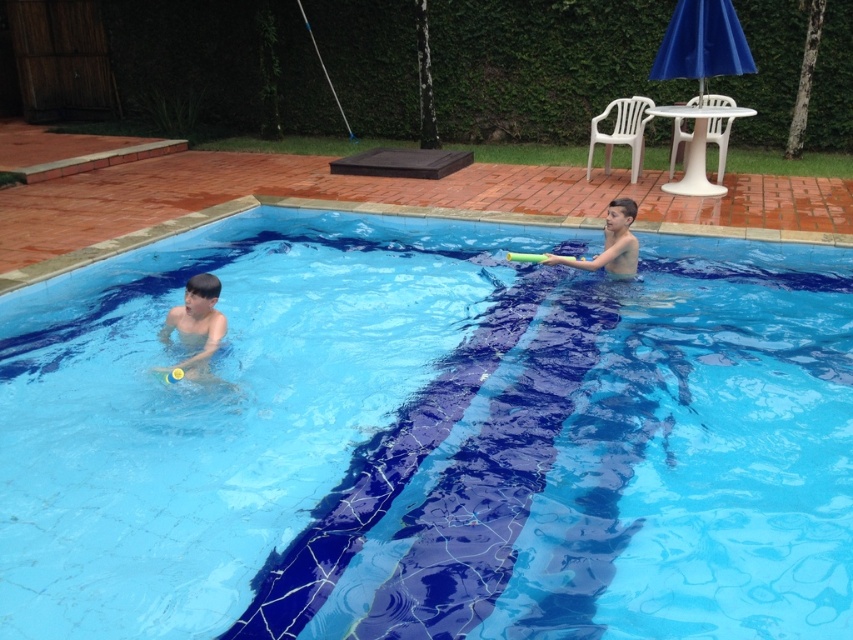
Is point (686, 468) farther from viewer compared to point (212, 310)?

No, (686, 468) is in front of (212, 310).

Who is lower down, transparent blue water at center or matte black boy at left?

transparent blue water at center

Identify the location of transparent blue water at center. This screenshot has width=853, height=640. (430, 440).

The height and width of the screenshot is (640, 853). Identify the location of transparent blue water at center. (430, 440).

Can you confirm if transparent blue water at center is thinner than smooth yellow toy at upper right?

Incorrect, transparent blue water at center's width is not less than smooth yellow toy at upper right's.

Measure the distance from transparent blue water at center to smooth yellow toy at upper right.

transparent blue water at center is 2.15 meters away from smooth yellow toy at upper right.

Locate an element on the screen. The width and height of the screenshot is (853, 640). transparent blue water at center is located at coordinates (430, 440).

Who is shorter, matte black boy at left or smooth yellow toy at upper right?

Standing shorter between the two is smooth yellow toy at upper right.

The image size is (853, 640). Identify the location of matte black boy at left. (196, 323).